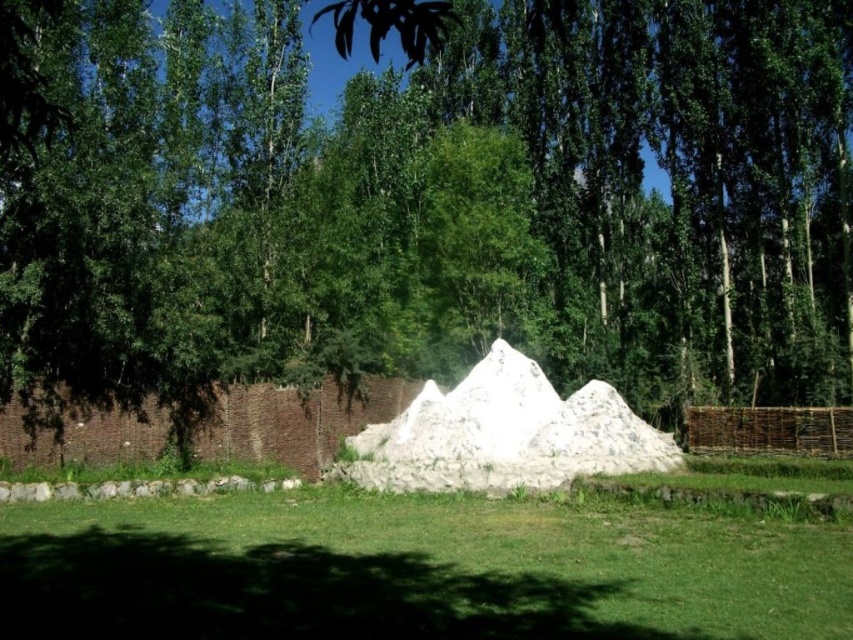
You are a gardener planning to plant a new tree in the green grass at center. Considering the height of the white sand pyramid at center, will the tree have enough space to grow upwards without obstruction?

The green grass at center has a lesser height compared to the white sand pyramid at center, so the tree planted in the green grass at center will have enough vertical space to grow upwards since the pyramid is taller and does not block the growth path.

You are a landscape architect designing a new garden. You need to place a decorative statue that requires a 10 feet clearance from any obstacles. Given the green leafy tree at center and the white sand pyramid at center, can you safely place the statue between them?

The green leafy tree at center is 31.33 feet from the white sand pyramid at center. Since the statue requires 10 feet clearance from any obstacles, the 31.33 feet distance between them allows sufficient space to place the statue between them while maintaining the required clearance.

You are a gardener assessing the plants in the scene. Which of the two plants, the green leafy tree at center or the green grass at center, is taller?

The green leafy tree at center is taller than the green grass at center.